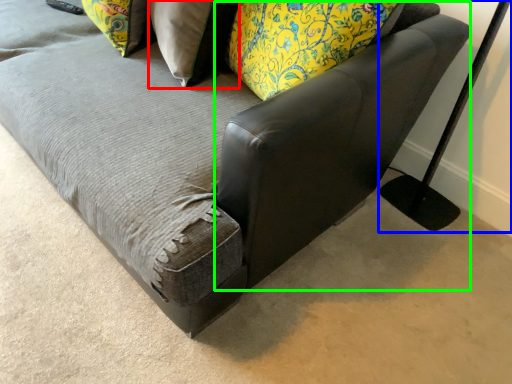
Question: Which object is the closest to the pillow (highlighted by a red box)? Choose among these: table lamp (highlighted by a blue box) or swivel chair (highlighted by a green box).

Choices:
 (A) table lamp
 (B) swivel chair

Answer: (B)